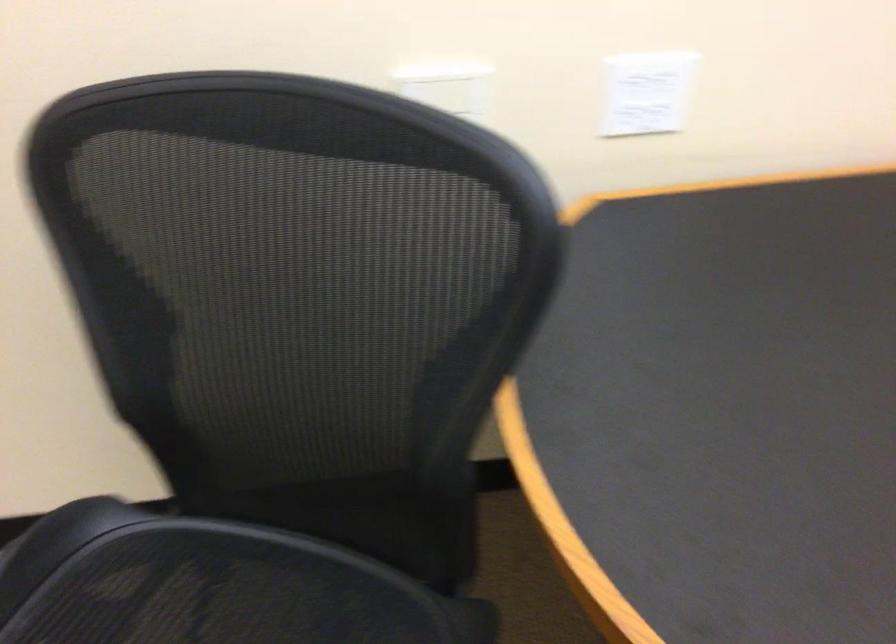
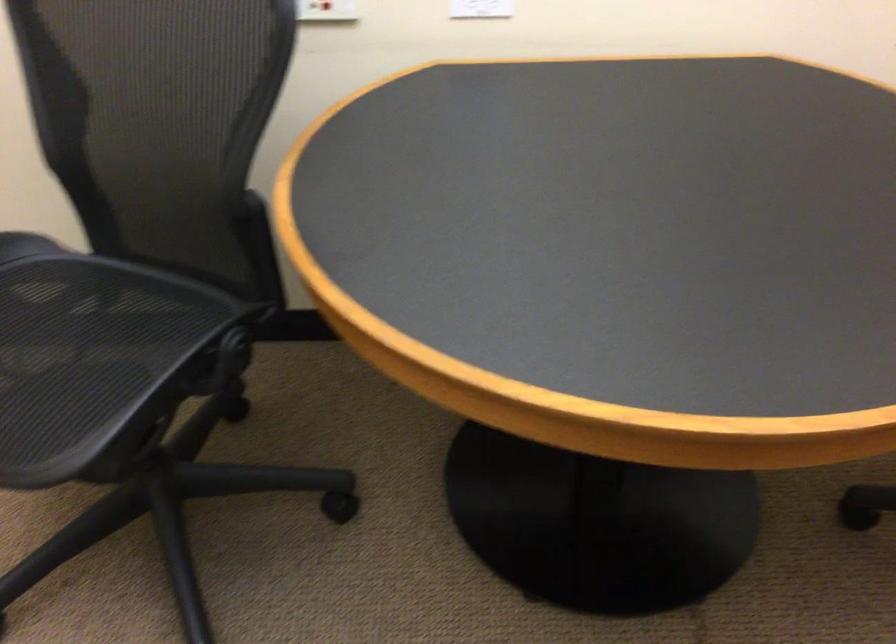
Locate, in the second image, the point that corresponds to point 453,552 in the first image.

(264, 277)